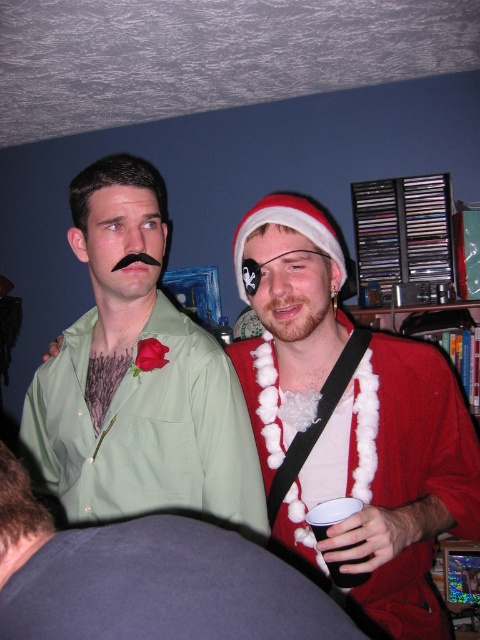
You are standing in the room and want to find the green matte shirt at center. According to the coordinates provided, where should you look relative to the image frame?

The green matte shirt at center is located at the 2D coordinates point 0.591 on the x axis and 0.287 on the y axis within the image frame.

You are standing in the room and want to know how far the point at coordinates (383,445) is from you. Can you determine the distance?

The point at coordinates (383,445) is 37.06 inches from the camera, so the distance from you to that point is approximately 37.06 inches.